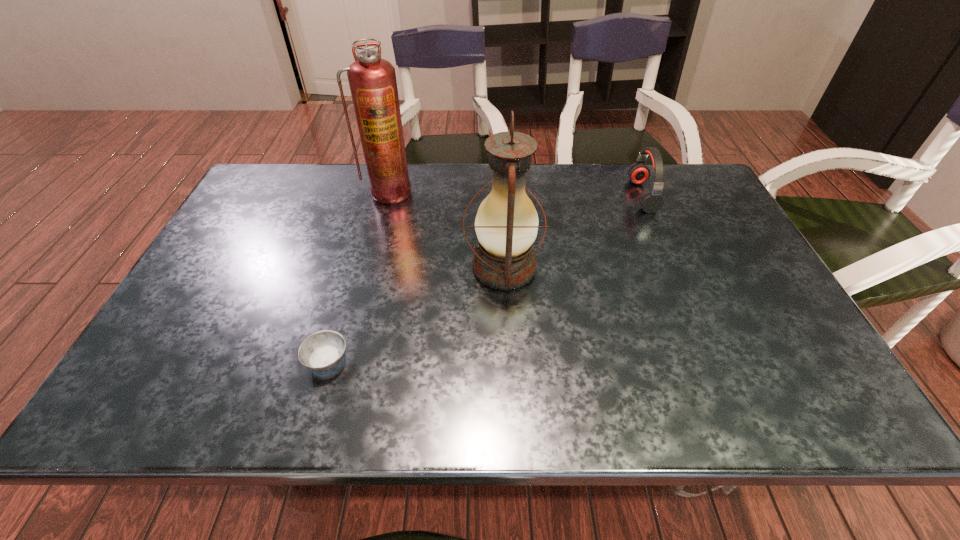
Find the location of `fire extinguisher`. fire extinguisher is located at coordinates (372, 80).

Find the location of a particular element. This screenshot has width=960, height=540. the third object from left to right is located at coordinates (506, 224).

The width and height of the screenshot is (960, 540). Identify the location of the third farthest object. (506, 224).

The height and width of the screenshot is (540, 960). Find the location of `the rightmost object`. the rightmost object is located at coordinates (651, 201).

The image size is (960, 540). I want to click on earphone, so click(651, 201).

Where is `the nearest object`? The height and width of the screenshot is (540, 960). the nearest object is located at coordinates (322, 351).

At what (x,y) coordinates should I click in order to perform the action: click on the shortest object. Please return your answer as a coordinate pair (x, y). The image size is (960, 540). Looking at the image, I should click on tap(322, 351).

This screenshot has width=960, height=540. I want to click on vacant position located 0.390m on the side of the fire extinguisher with the label, so pos(361,306).

The width and height of the screenshot is (960, 540). I want to click on blank space located 0.160m on the back of the third object from left to right, so click(500, 202).

Identify the location of blank space located on the ear cups of the rightmost object. (535, 195).